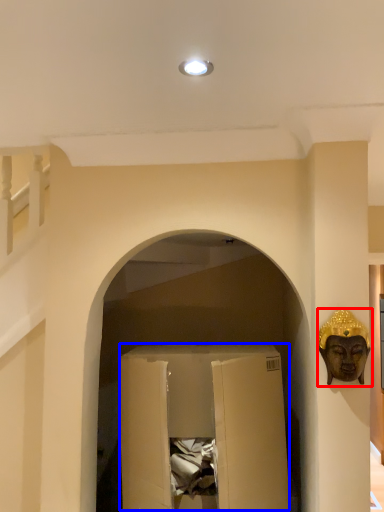
Question: Which point is further to the camera, person (highlighted by a red box) or wide (highlighted by a blue box)?

Choices:
 (A) person
 (B) wide

Answer: (B)